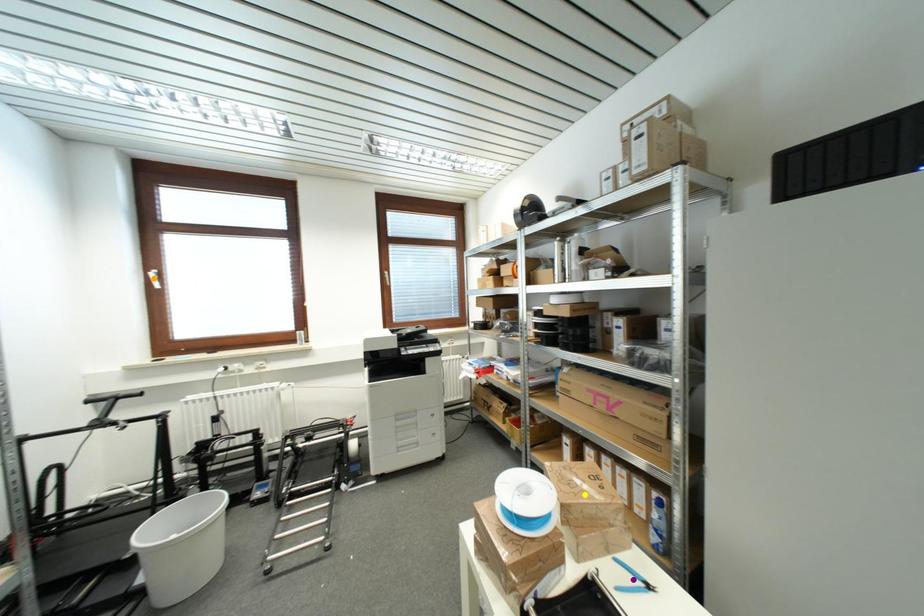
Consider the image. Order these from nearest to farthest:
- orange point
- yellow point
- purple point

purple point → yellow point → orange point